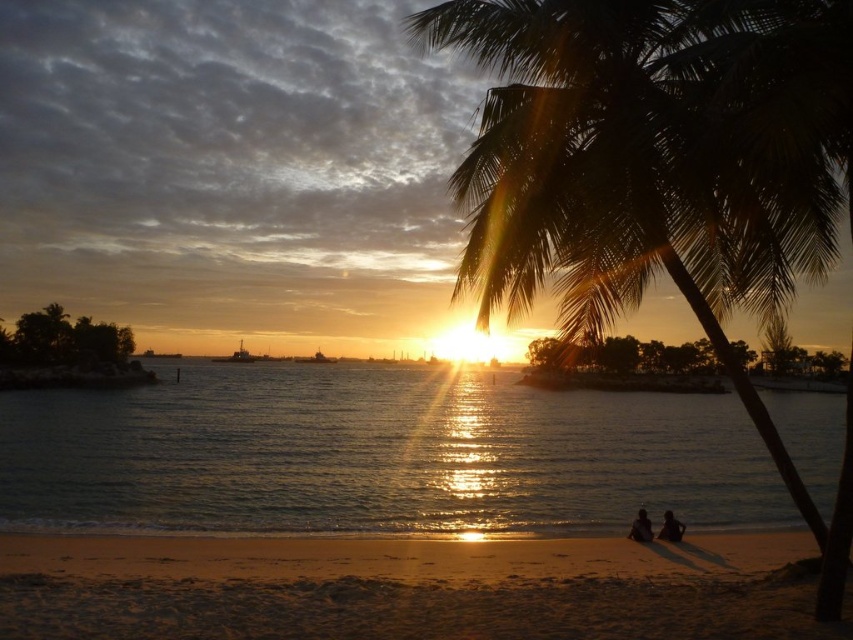
You are a photographer trying to capture the sunset scene. You notice the green leafy palm tree at right and the silhouette human at lower right. Which object is wider in the image?

The green leafy palm tree at right is wider than the silhouette human at lower right.

You are a photographer standing on the sandy beach at lower center and want to take a photo of the dark skin human at lower right. Which direction should you move to get them in the frame?

The sandy beach at lower center is to the left of the dark skin human at lower right, so you should move to your right to get them in the frame.

You are a photographer trying to capture the sunset scene. You notice the sandy beach at lower center and the dark skin human at lower right in your viewfinder. Based on their relative heights, which object would appear larger in your photo?

The sandy beach at lower center would appear larger in the photo because it is much taller than the dark skin human at lower right.